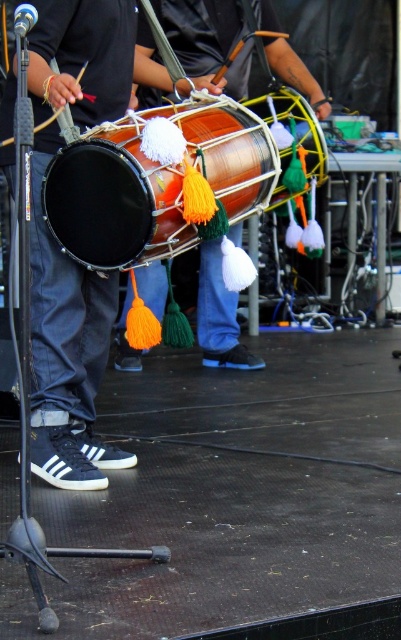
You are a stagehand setting up for a performance. You need to place a new microphone stand between the matte black drum at left and the matte orange drum at center. The microphone stand requires at least 1 meter of space to the left and right. Is there enough space between them?

The matte black drum at left is much taller than the matte orange drum at center, but the description does not provide information about the horizontal distance between them. Therefore, it is impossible to determine if there is enough space for the microphone stand based on the given details.

You are a drummer who needs to choose between the matte copper drum at center and the shiny copper drum at center for a performance. Based on their height, which drum would require you to stand further back to play comfortably?

The matte copper drum at center is much taller than the shiny copper drum at center, so you would need to stand further back to play the matte copper drum at center comfortably.

You are a stagehand setting up for a performance. You need to place a new microphone stand that is 1.2 meters tall between the matte black drum at left and the matte copper drum at center. Considering the height of the drums, will the microphone stand be taller than both drums?

The matte black drum at left is taller than the matte copper drum at center. Since the microphone stand is 1.2 meters tall, we need to compare it with the height of the taller drum, which is the matte black drum at left. If the matte black drum at left is taller than 1.2 meters, then the microphone stand will not be taller than both. However, without specific height measurements for the drums, we cannot definitively determine if the microphone stand will be taller than both drums.